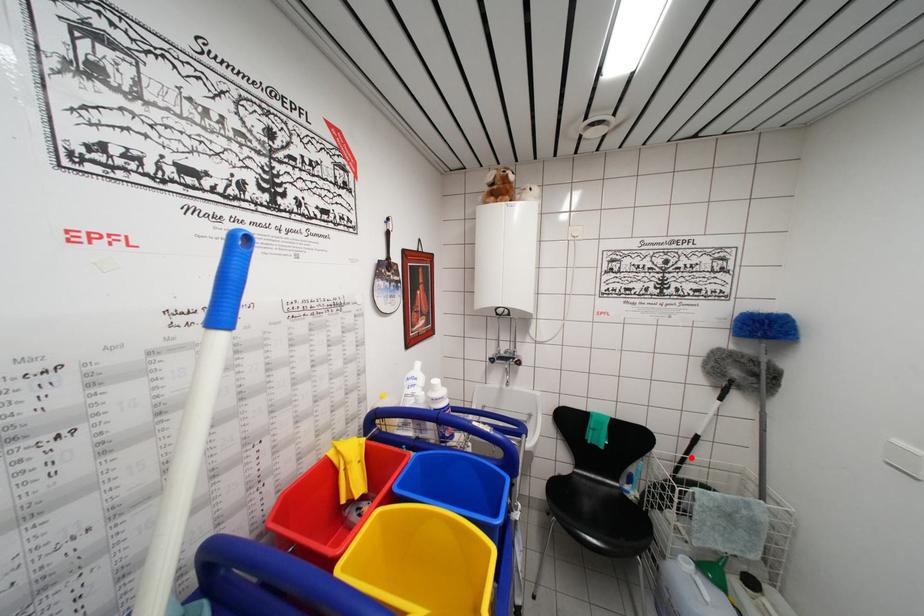
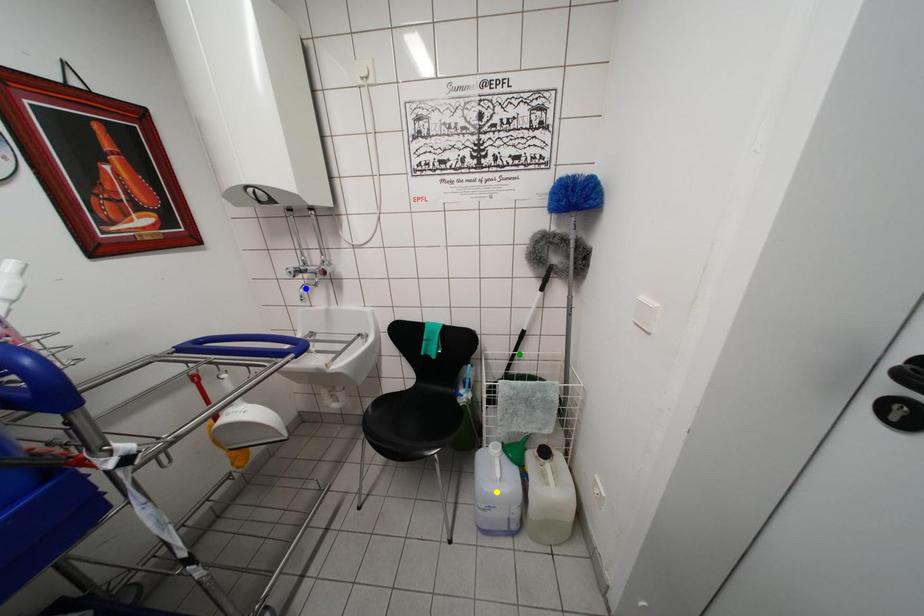
Question: I am providing you with two images of the same scene from different viewpoints. A red point is marked on the first image. You are given multiple points on the second image. In image 2, which mark is for the same physical point as the one in image 1?

Choices:
 (A) green point
 (B) blue point
 (C) yellow point

Answer: (A)